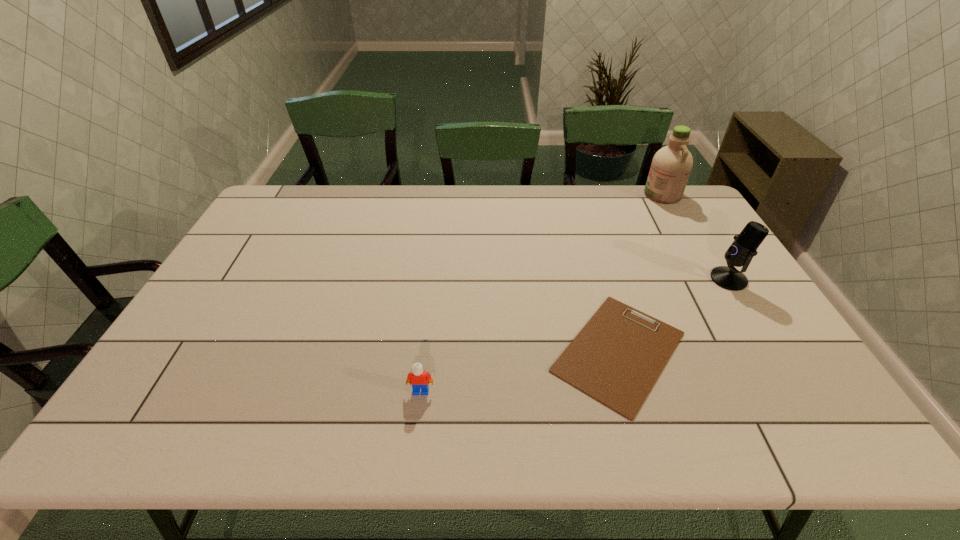
Locate an element on the screen. This screenshot has height=540, width=960. vacant region located on the front label of the farthest object is located at coordinates (610, 194).

Image resolution: width=960 pixels, height=540 pixels. I want to click on vacant area situated 0.290m on the stand of the microphone, so click(612, 279).

This screenshot has height=540, width=960. I want to click on free spot located 0.230m on the stand of the microphone, so click(x=633, y=279).

Find the location of a particular element. This screenshot has height=540, width=960. vacant space located 0.150m on the stand of the microphone is located at coordinates (660, 279).

Locate an element on the screen. The width and height of the screenshot is (960, 540). free space located on the face of the leftmost object is located at coordinates (418, 415).

Identify the location of free space located 0.260m on the back of the clipboard. The width and height of the screenshot is (960, 540). (587, 241).

Image resolution: width=960 pixels, height=540 pixels. I want to click on object positioned at the far edge, so click(x=671, y=165).

Where is `object situated at the near edge`? The height and width of the screenshot is (540, 960). object situated at the near edge is located at coordinates (617, 357).

Identify the location of cleansing agent that is at the right edge. The width and height of the screenshot is (960, 540). (671, 165).

Where is `microphone that is at the right edge`? The height and width of the screenshot is (540, 960). microphone that is at the right edge is located at coordinates (740, 253).